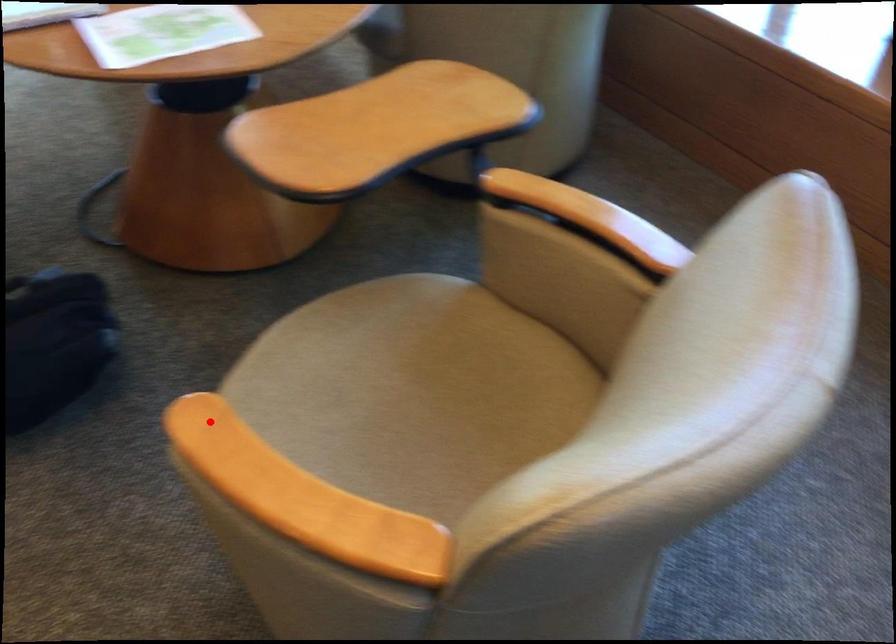
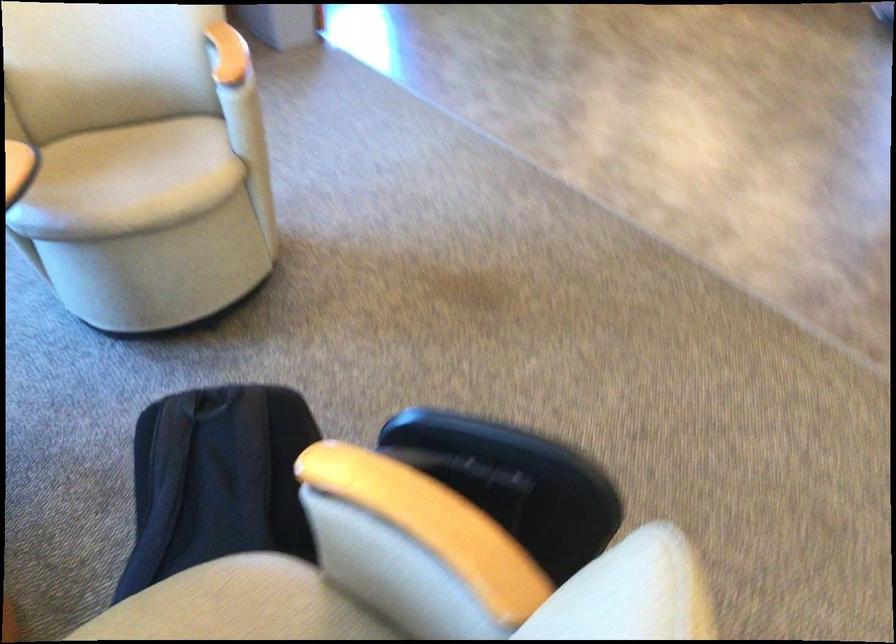
Where in the second image is the point corresponding to the highlighted location from the first image?

(127, 180)